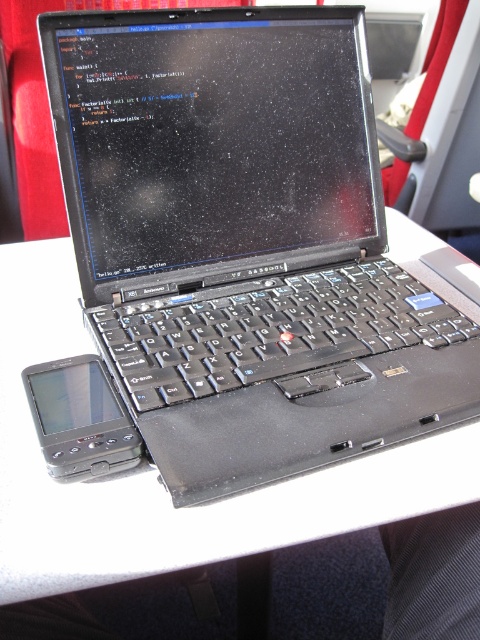
Question: Does black matte laptop at center have a lesser width compared to white plastic table at center?

Choices:
 (A) no
 (B) yes

Answer: (B)

Question: Is black matte laptop at center to the right of white plastic table at center from the viewer's perspective?

Choices:
 (A) no
 (B) yes

Answer: (B)

Question: Which point appears closest to the camera in this image?

Choices:
 (A) (84, 358)
 (B) (94, 556)

Answer: (B)

Question: Which point is closer to the camera?

Choices:
 (A) black plastic smartphone at lower left
 (B) white plastic table at center
 (C) black matte laptop at center

Answer: (B)

Question: Among these points, which one is nearest to the camera?

Choices:
 (A) (61, 392)
 (B) (326, 321)

Answer: (A)

Question: Is white plastic table at center above black plastic smartphone at lower left?

Choices:
 (A) yes
 (B) no

Answer: (A)